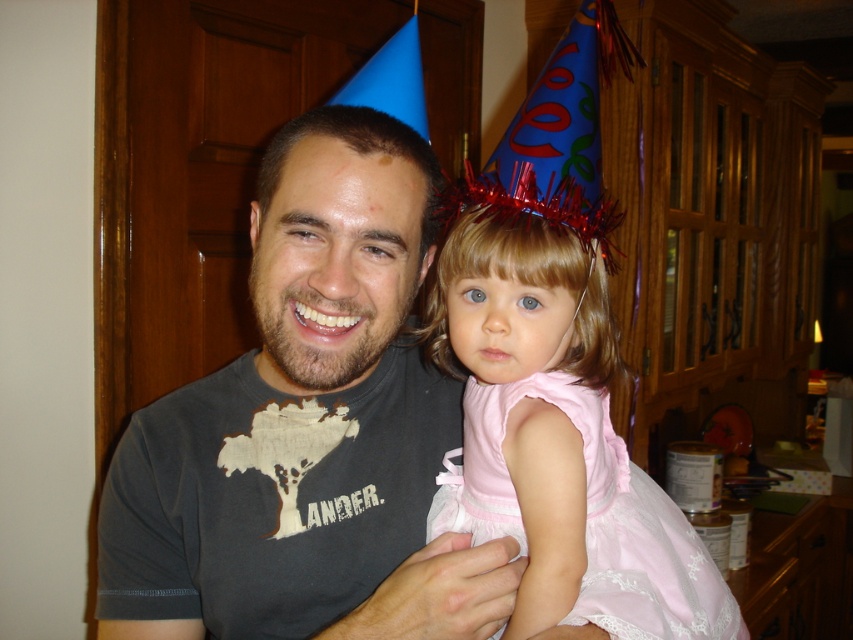
Between point (341, 401) and point (511, 508), which one is positioned in front?

Point (511, 508) is in front.

Does dark gray t-shirt at center appear under pink satin dress at center?

No.

The width and height of the screenshot is (853, 640). Find the location of `dark gray t-shirt at center`. dark gray t-shirt at center is located at coordinates (306, 428).